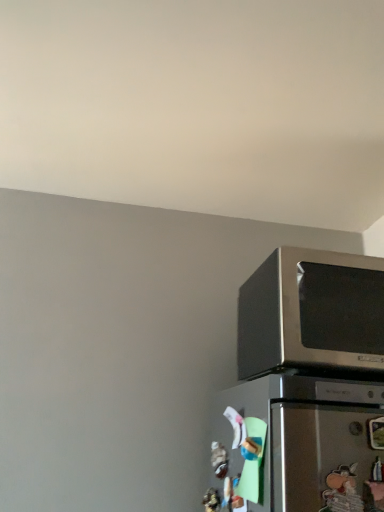
Image resolution: width=384 pixels, height=512 pixels. What do you see at coordinates (312, 312) in the screenshot? I see `satin silver microwave at upper right` at bounding box center [312, 312].

Measure the distance between satin silver microwave at upper right and camera.

The depth of satin silver microwave at upper right is 36.29 inches.

This screenshot has width=384, height=512. Find the location of `satin silver microwave at upper right`. satin silver microwave at upper right is located at coordinates coord(312,312).

Find the location of a particular element. The image size is (384, 512). satin silver microwave at upper right is located at coordinates (312, 312).